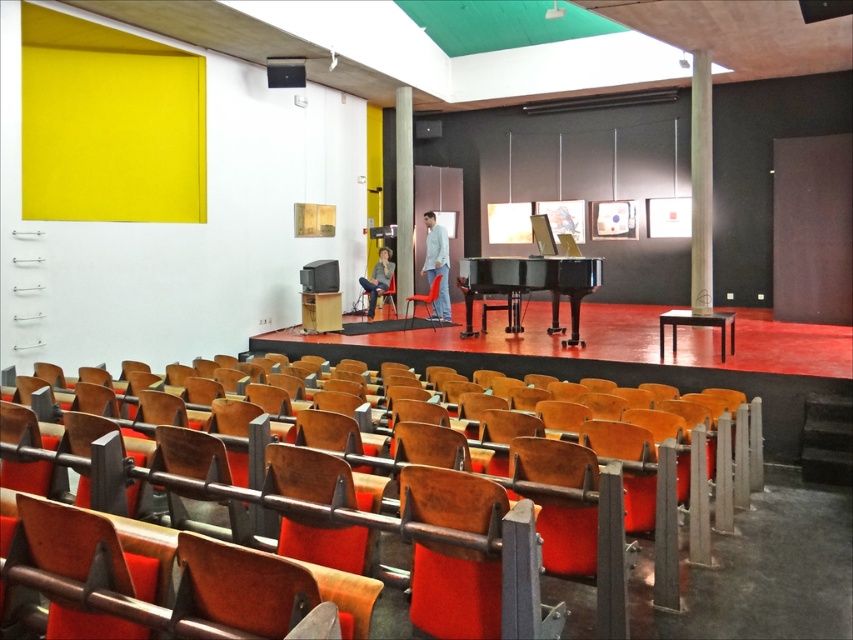
Question: Can you confirm if black glossy piano at center is positioned to the right of matte plastic chair at center?

Choices:
 (A) yes
 (B) no

Answer: (A)

Question: Which of these objects is positioned farthest from the wooden chair at center?

Choices:
 (A) black glossy piano at center
 (B) wooden seat at lower center
 (C) matte plastic chair at center
 (D) white matte shirt at center

Answer: (B)

Question: Does white matte shirt at center appear over wooden chair at center?

Choices:
 (A) no
 (B) yes

Answer: (B)

Question: Which point appears farthest from the camera in this image?

Choices:
 (A) [413, 307]
 (B) [482, 320]

Answer: (A)

Question: Which is nearer to the black glossy piano at center?

Choices:
 (A) white matte shirt at center
 (B) wooden seat at lower center
 (C) wooden chair at center
 (D) matte plastic chair at center

Answer: (A)

Question: Does wooden chair at center appear over matte plastic chair at center?

Choices:
 (A) no
 (B) yes

Answer: (B)